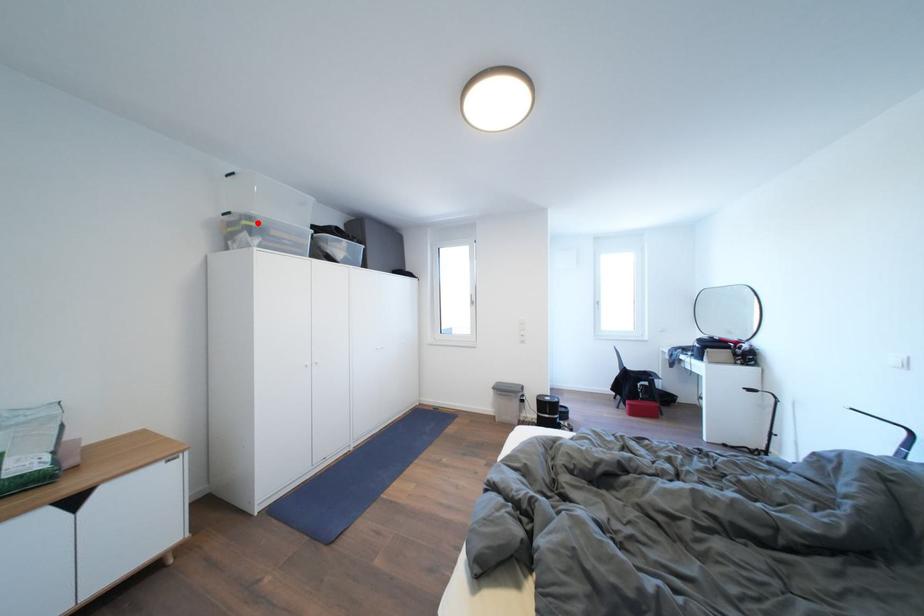
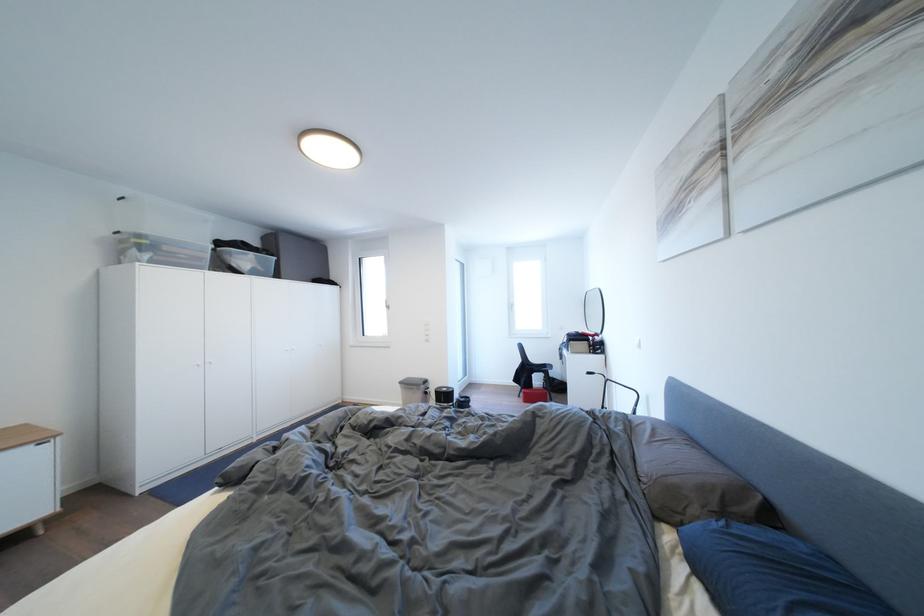
Locate, in the second image, the point that corresponds to the highlighted location in the first image.

(149, 241)